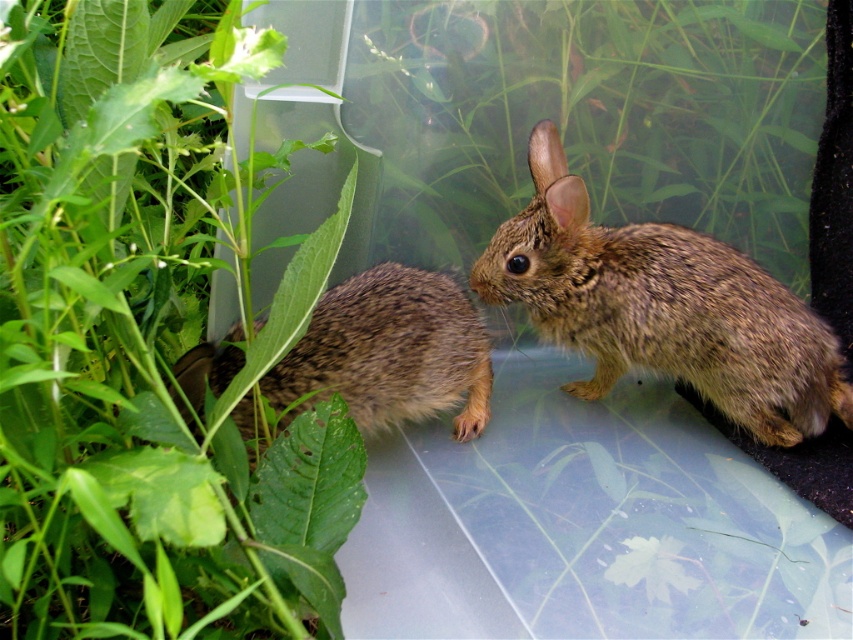
You are a wildlife photographer observing two brown fuzzy rabbits in a terrarium. You need to determine which rabbit is wider. Which one is wider between the brown fuzzy rabbit at center and the brown fuzzy rabbit at left?

The brown fuzzy rabbit at center is wider than the brown fuzzy rabbit at left.

You are a wildlife photographer trying to capture a closeup of the brown fuzzy rabbit at center and the brown fuzzy rabbit at left. Since the container is transparent, you need to ensure your camera is positioned so that both rabbits are in focus. Given that the rabbit at center is closer to the camera, will focusing on the closer rabbit also keep the one at left in focus?

The brown fuzzy rabbit at center is closer to the camera than the brown fuzzy rabbit at left. However, focusing on the closer rabbit may not guarantee the one at left is in focus, as depth of field depends on factors like aperture setting. To ensure both are sharp, use a smaller aperture for greater depth of field or focus on a point between them.